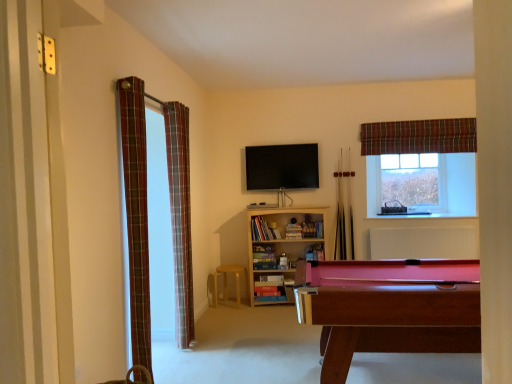
Question: Is clear glass window at upper right bigger than light brown wooden stool at center?

Choices:
 (A) yes
 (B) no

Answer: (B)

Question: Does clear glass window at upper right lie behind light brown wooden stool at center?

Choices:
 (A) yes
 (B) no

Answer: (A)

Question: Is clear glass window at upper right completely or partially outside of light brown wooden stool at center?

Choices:
 (A) no
 (B) yes

Answer: (B)

Question: Can you confirm if clear glass window at upper right is shorter than light brown wooden stool at center?

Choices:
 (A) no
 (B) yes

Answer: (A)

Question: Is clear glass window at upper right facing away from light brown wooden stool at center?

Choices:
 (A) no
 (B) yes

Answer: (A)

Question: Would you say clear glass window at upper right contains light brown wooden stool at center?

Choices:
 (A) no
 (B) yes

Answer: (A)

Question: Is clear glass window at upper right positioned before plaid fabric curtain at left, marked as the 2th curtain in a left-to-right arrangement?

Choices:
 (A) no
 (B) yes

Answer: (A)

Question: Are clear glass window at upper right and plaid fabric curtain at left, marked as the 2th curtain in a left-to-right arrangement, far apart?

Choices:
 (A) no
 (B) yes

Answer: (B)

Question: Is clear glass window at upper right wider than plaid fabric curtain at left, the second curtain in the front-to-back sequence?

Choices:
 (A) no
 (B) yes

Answer: (A)

Question: Is clear glass window at upper right taller than plaid fabric curtain at left, the second curtain in the front-to-back sequence?

Choices:
 (A) yes
 (B) no

Answer: (B)

Question: Is clear glass window at upper right shorter than plaid fabric curtain at left, the second curtain in the front-to-back sequence?

Choices:
 (A) yes
 (B) no

Answer: (A)

Question: Are clear glass window at upper right and plaid fabric curtain at left, the second curtain in the front-to-back sequence, making contact?

Choices:
 (A) no
 (B) yes

Answer: (A)

Question: Can you confirm if mahogany wood pool table at lower right is wider than light brown wooden stool at center?

Choices:
 (A) no
 (B) yes

Answer: (B)